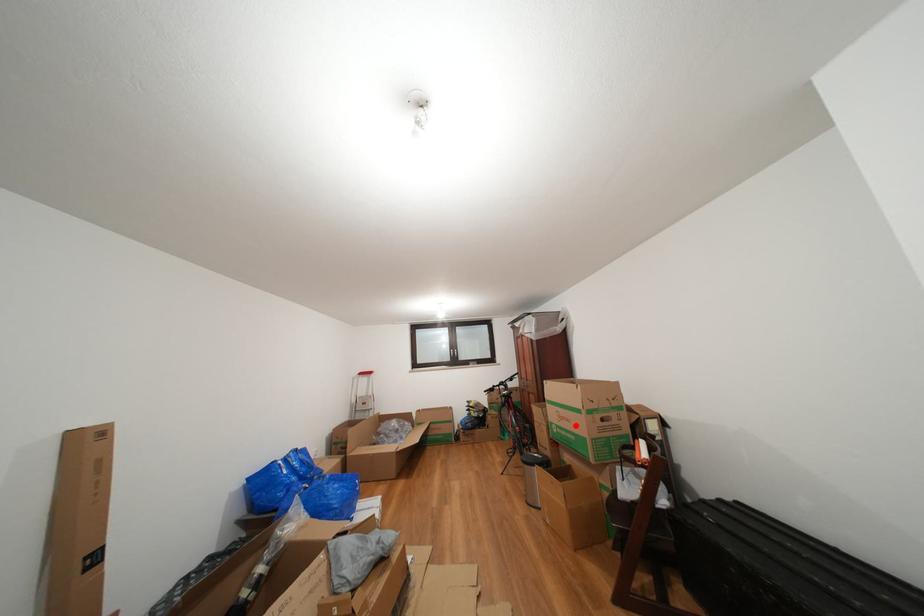
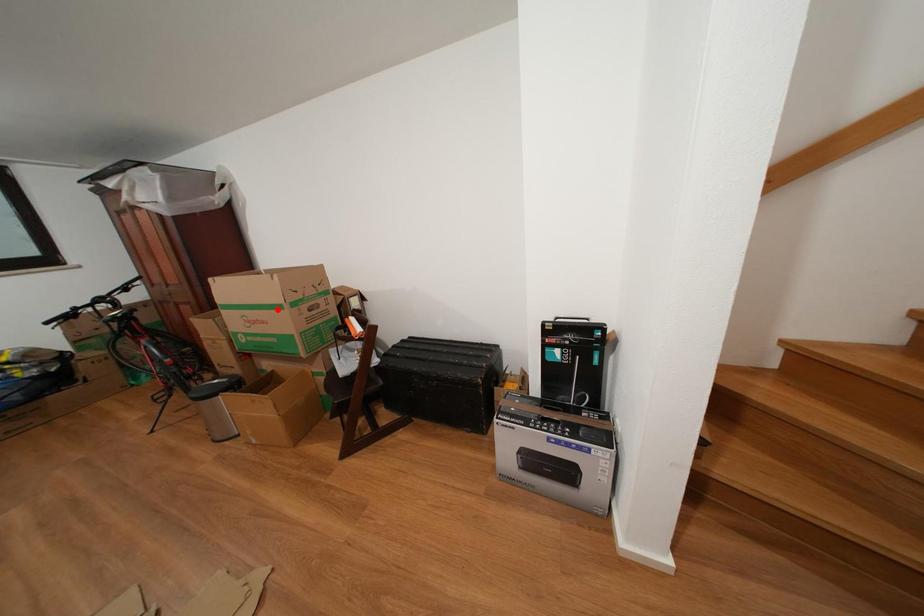
I am providing you with two images of the same scene from different viewpoints. A red point is marked on the first image and another point is marked on the second image. Are the points marked in image1 and image2 representing the same 3D position?

No